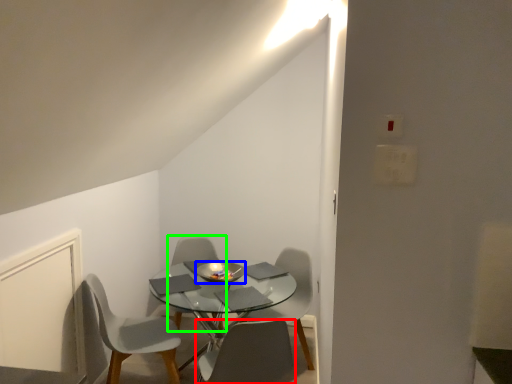
Question: Which is nearer to the chair (highlighted by a red box)? bowl (highlighted by a blue box) or chair (highlighted by a green box).

Choices:
 (A) bowl
 (B) chair

Answer: (A)